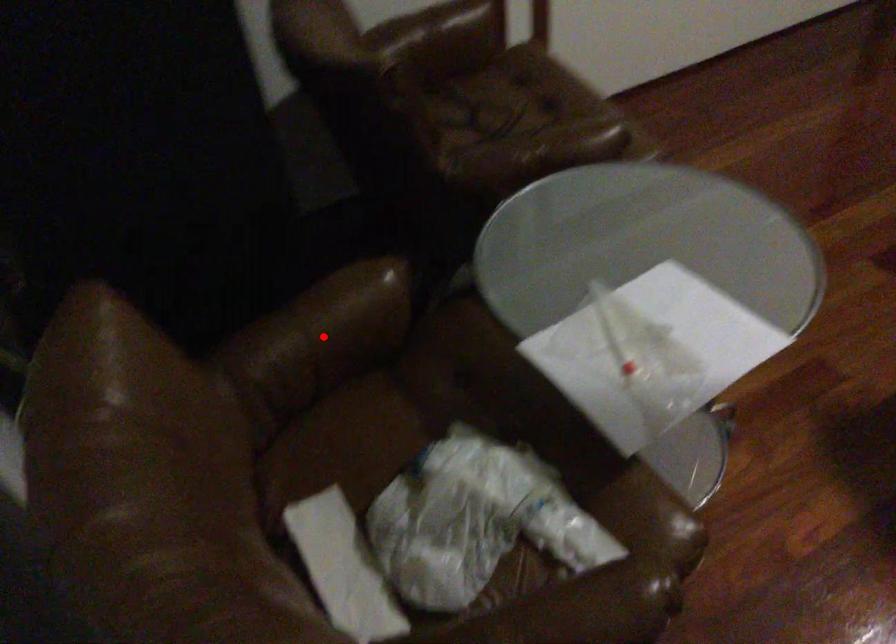
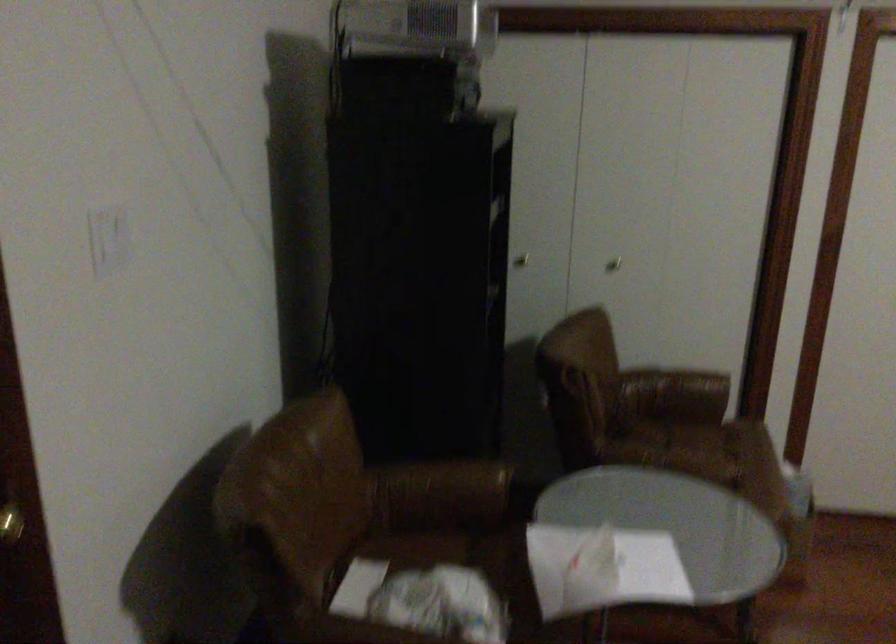
In the second image, find the point that corresponds to the highlighted location in the first image.

(442, 488)